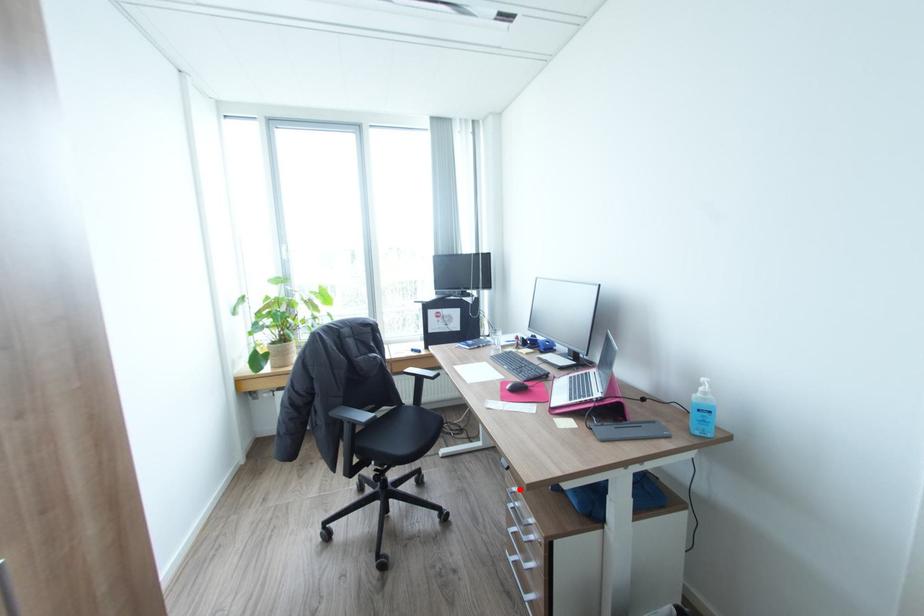
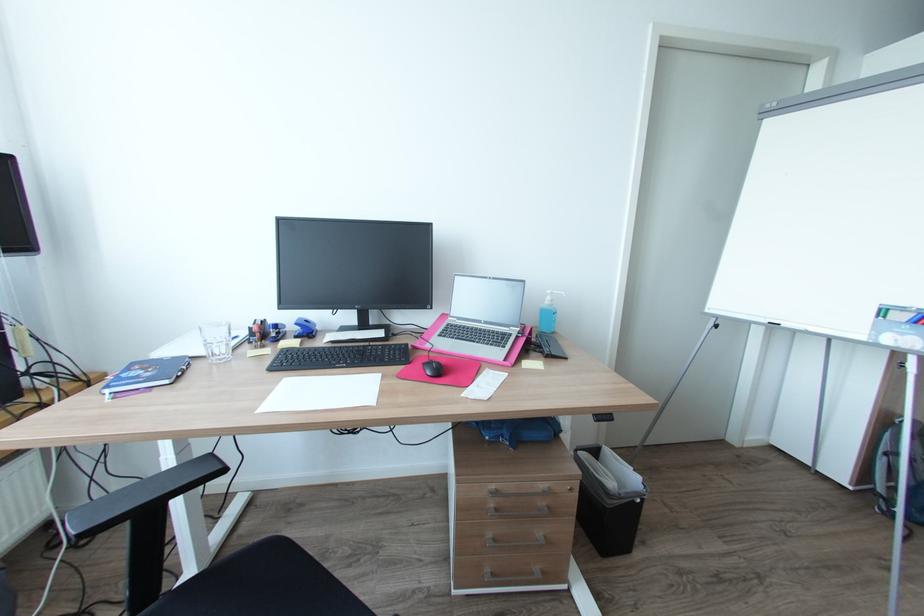
Question: I am providing you with two images of the same scene from different viewpoints. A red point is shown in image1. For the corresponding object point in image2, is it positioned nearer or farther from the camera?

Choices:
 (A) Nearer
 (B) Farther

Answer: (A)